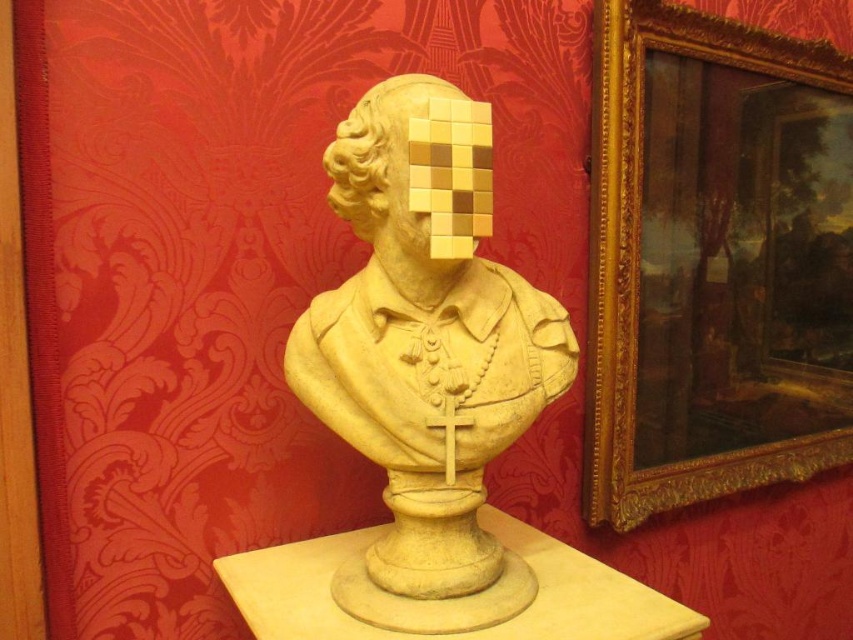
Question: Is gold ornate frame at upper right wider than matte stone bust at center?

Choices:
 (A) no
 (B) yes

Answer: (B)

Question: Does gold ornate frame at upper right come behind beige stone bust at center?

Choices:
 (A) yes
 (B) no

Answer: (A)

Question: In this image, where is gold ornate frame at upper right located relative to matte stone bust at center?

Choices:
 (A) above
 (B) below

Answer: (A)

Question: Which of the following is the farthest from the observer?

Choices:
 (A) gold ornate frame at upper right
 (B) beige stone bust at center

Answer: (A)

Question: Considering the real-world distances, which object is farthest from the gold ornate frame at upper right?

Choices:
 (A) matte stone bust at center
 (B) beige stone bust at center

Answer: (B)

Question: Based on their relative distances, which object is farther from the gold ornate frame at upper right?

Choices:
 (A) beige stone bust at center
 (B) matte stone bust at center

Answer: (A)